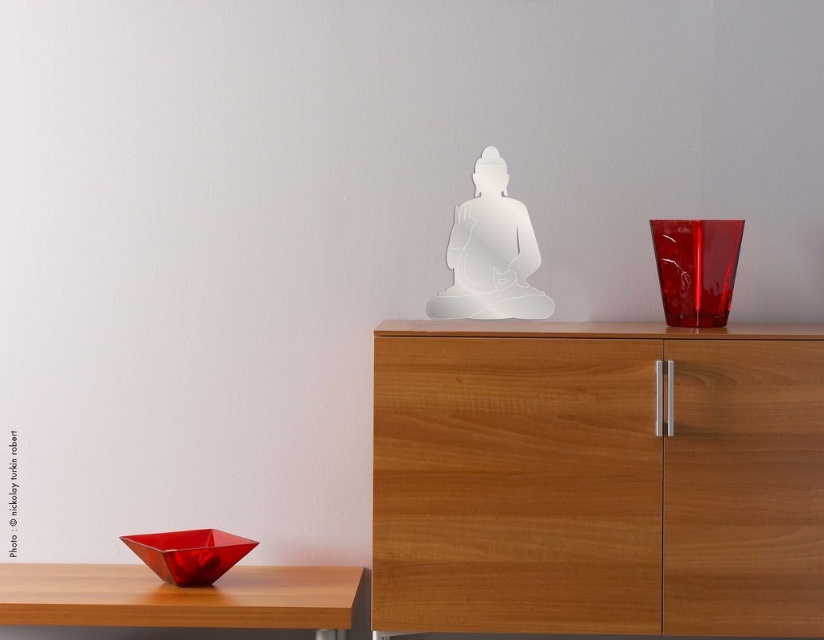
Consider the image. Between wooden cabinet at upper center and transparent glass buddha at center, which one is positioned lower?

wooden cabinet at upper center is below.

Does point (565, 324) lie in front of point (448, 308)?

Yes, it is.

Who is more forward, (780,353) or (459,214)?

Point (780,353) is in front.

Identify the location of wooden cabinet at upper center. [x=597, y=477].

Who is more distant from viewer, (172,624) or (476,161)?

Positioned behind is point (476,161).

From the picture: Between wooden table at lower left and transparent glass buddha at center, which one has less height?

With less height is wooden table at lower left.

Is point (113, 576) closer to viewer compared to point (474, 182)?

Yes, point (113, 576) is in front of point (474, 182).

Identify the location of wooden table at lower left. (179, 596).

Who is taller, wooden table at lower left or transparent glass vase at upper right?

Standing taller between the two is transparent glass vase at upper right.

What do you see at coordinates (179, 596) in the screenshot? The width and height of the screenshot is (824, 640). I see `wooden table at lower left` at bounding box center [179, 596].

Locate an element on the screen. wooden table at lower left is located at coordinates (179, 596).